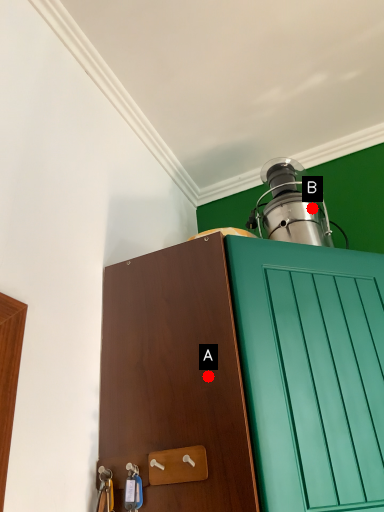
Question: Two points are circled on the image, labeled by A and B beside each circle. Which point is further to the camera?

Choices:
 (A) A is further
 (B) B is further

Answer: (B)